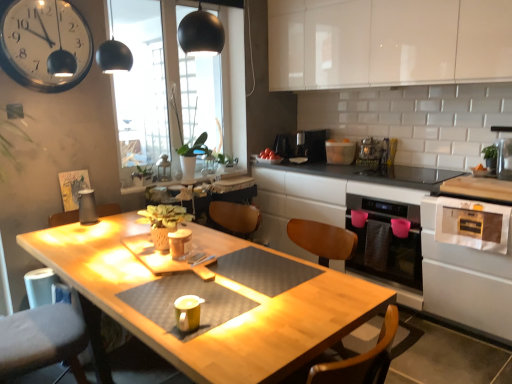
Where is `free space to the left of matte yellow cup at center, the eighth appliance positioned from the back`? free space to the left of matte yellow cup at center, the eighth appliance positioned from the back is located at coordinates (155, 314).